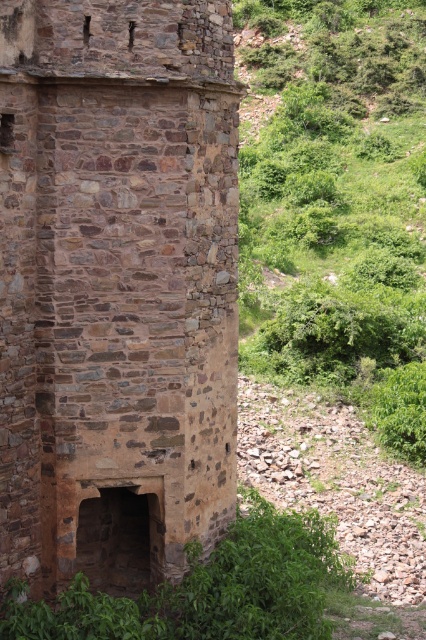
Question: Considering the relative positions of brown stone tower at left and green leafy shrubs at right in the image provided, where is brown stone tower at left located with respect to green leafy shrubs at right?

Choices:
 (A) right
 (B) left

Answer: (B)

Question: Which is nearer to the green leafy shrubs at right?

Choices:
 (A) brown stone tower at left
 (B) green leafy vegetation at lower center

Answer: (A)

Question: Does green leafy shrubs at right appear on the right side of green leafy vegetation at lower center?

Choices:
 (A) yes
 (B) no

Answer: (A)

Question: Is brown stone tower at left bigger than green leafy vegetation at lower center?

Choices:
 (A) no
 (B) yes

Answer: (B)

Question: Estimate the real-world distances between objects in this image. Which object is closer to the green leafy shrubs at right?

Choices:
 (A) brown stone tower at left
 (B) green leafy vegetation at lower center

Answer: (A)

Question: Among these objects, which one is nearest to the camera?

Choices:
 (A) brown stone tower at left
 (B) green leafy shrubs at right

Answer: (A)